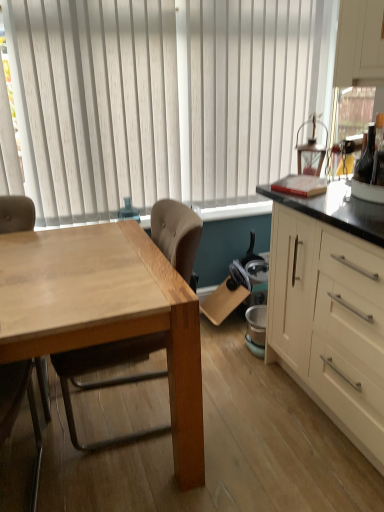
This screenshot has height=512, width=384. I want to click on light brown wood chair at left, acting as the first chair starting from the right, so click(x=107, y=380).

Image resolution: width=384 pixels, height=512 pixels. Describe the element at coordinates (107, 380) in the screenshot. I see `light brown wood chair at left, acting as the 2th chair starting from the left` at that location.

In order to face white vertical blinds at upper center, should I rotate leftwards or rightwards?

You should look left and rotate roughly 1.373 degrees.

This screenshot has height=512, width=384. In order to click on white vertical blinds at upper center in this screenshot , I will do `click(164, 100)`.

Measure the distance between white matte cabinet at right and camera.

A distance of 1.30 meters exists between white matte cabinet at right and camera.

Identify the location of light brown wood chair at left, acting as the 2th chair starting from the left. The image size is (384, 512). (107, 380).

Does white vertical blinds at upper center have a smaller size compared to white matte cabinet at right?

Correct, white vertical blinds at upper center occupies less space than white matte cabinet at right.

At what (x,y) coordinates should I click in order to perform the action: click on cabinetry located on the right of white vertical blinds at upper center. Please return your answer as a coordinate pair (x, y). Looking at the image, I should click on (330, 308).

From the image's perspective, is white vertical blinds at upper center above or below white matte cabinet at right?

From the image's perspective, white vertical blinds at upper center appears above white matte cabinet at right.

In terms of width, does white vertical blinds at upper center look wider or thinner when compared to white matte cabinet at right?

In the image, white vertical blinds at upper center appears to be more narrow than white matte cabinet at right.

Considering the sizes of objects white vertical blinds at upper center and light brown wood chair at left, which is the 1th chair in left-to-right order, in the image provided, who is smaller, white vertical blinds at upper center or light brown wood chair at left, which is the 1th chair in left-to-right order,?

Smaller between the two is light brown wood chair at left, which is the 1th chair in left-to-right order.

Considering the sizes of white vertical blinds at upper center and light brown wood chair at left, marked as the 2th chair in a right-to-left arrangement, in the image, is white vertical blinds at upper center wider or thinner than light brown wood chair at left, marked as the 2th chair in a right-to-left arrangement,?

white vertical blinds at upper center is thinner than light brown wood chair at left, marked as the 2th chair in a right-to-left arrangement.

From a real-world perspective, which is physically above, white vertical blinds at upper center or light brown wood chair at left, which is the 1th chair in left-to-right order?

white vertical blinds at upper center, from a real-world perspective.

Where is `the 2nd chair located beneath the white vertical blinds at upper center (from a real-world perspective)`? This screenshot has height=512, width=384. the 2nd chair located beneath the white vertical blinds at upper center (from a real-world perspective) is located at coordinates (16, 214).

From a real-world perspective, which is physically above, light brown wood chair at left, marked as the 2th chair in a right-to-left arrangement, or white vertical blinds at upper center?

white vertical blinds at upper center, from a real-world perspective.

From the image's perspective, which one is positioned lower, light brown wood chair at left, which is the 1th chair in left-to-right order, or white vertical blinds at upper center?

From the image's view, light brown wood chair at left, which is the 1th chair in left-to-right order, is below.

Which object is closer to the camera, light brown wood chair at left, which is the 1th chair in left-to-right order, or white vertical blinds at upper center?

light brown wood chair at left, which is the 1th chair in left-to-right order, is closer to the camera.

Where is `window blind on the right of light brown wood chair at left, acting as the 2th chair starting from the left`? Image resolution: width=384 pixels, height=512 pixels. window blind on the right of light brown wood chair at left, acting as the 2th chair starting from the left is located at coordinates (164, 100).

Can you confirm if light brown wood chair at left, acting as the first chair starting from the right, is positioned to the right of white vertical blinds at upper center?

Incorrect, light brown wood chair at left, acting as the first chair starting from the right, is not on the right side of white vertical blinds at upper center.

Could you tell me if light brown wood chair at left, acting as the 2th chair starting from the left, is facing white vertical blinds at upper center?

No, light brown wood chair at left, acting as the 2th chair starting from the left, is not turned towards white vertical blinds at upper center.

Is light brown wood chair at left, acting as the first chair starting from the right, in front of or behind white vertical blinds at upper center in the image?

light brown wood chair at left, acting as the first chair starting from the right, is positioned closer to the viewer than white vertical blinds at upper center.

Is white vertical blinds at upper center touching light brown wood chair at left, acting as the first chair starting from the right?

No, white vertical blinds at upper center is not touching light brown wood chair at left, acting as the first chair starting from the right.

Can you confirm if white vertical blinds at upper center is smaller than light brown wood chair at left, acting as the 2th chair starting from the left?

Correct, white vertical blinds at upper center occupies less space than light brown wood chair at left, acting as the 2th chair starting from the left.

Is white vertical blinds at upper center at the right side of light brown wood chair at left, acting as the 2th chair starting from the left?

Correct, you'll find white vertical blinds at upper center to the right of light brown wood chair at left, acting as the 2th chair starting from the left.

Considering the positions of point (314, 11) and point (105, 352), is point (314, 11) closer or farther from the camera than point (105, 352)?

Point (314, 11) is farther from the camera than point (105, 352).

Which is in front, light brown wood chair at left, acting as the first chair starting from the right, or white matte cabinet at right?

Positioned in front is white matte cabinet at right.

Which is more to the left, light brown wood chair at left, acting as the first chair starting from the right, or white matte cabinet at right?

light brown wood chair at left, acting as the first chair starting from the right, is more to the left.

Is light brown wood chair at left, acting as the first chair starting from the right, completely or partially outside of white matte cabinet at right?

Absolutely, light brown wood chair at left, acting as the first chair starting from the right, is external to white matte cabinet at right.

From the image's perspective, which is above, light brown wood chair at left, acting as the 2th chair starting from the left, or white matte cabinet at right?

white matte cabinet at right.

Is light brown wood chair at left, acting as the 2th chair starting from the left, touching light brown wood chair at left, marked as the 2th chair in a right-to-left arrangement?

No, light brown wood chair at left, acting as the 2th chair starting from the left, is not beside light brown wood chair at left, marked as the 2th chair in a right-to-left arrangement.

Is light brown wood chair at left, acting as the first chair starting from the right, facing towards light brown wood chair at left, marked as the 2th chair in a right-to-left arrangement?

Yes, light brown wood chair at left, acting as the first chair starting from the right, is aimed at light brown wood chair at left, marked as the 2th chair in a right-to-left arrangement.

At what (x,y) coordinates should I click in order to perform the action: click on chair behind the light brown wood chair at left, acting as the first chair starting from the right. Please return your answer as a coordinate pair (x, y). This screenshot has width=384, height=512. Looking at the image, I should click on (16, 214).

Which object is positioned more to the left, light brown wood chair at left, acting as the 2th chair starting from the left, or light brown wood chair at left, marked as the 2th chair in a right-to-left arrangement?

From the viewer's perspective, light brown wood chair at left, marked as the 2th chair in a right-to-left arrangement, appears more on the left side.

Locate an element on the screen. The height and width of the screenshot is (512, 384). cabinetry on the right of white vertical blinds at upper center is located at coordinates (330, 308).

Image resolution: width=384 pixels, height=512 pixels. Find the location of `window blind behind the light brown wood chair at left, marked as the 2th chair in a right-to-left arrangement`. window blind behind the light brown wood chair at left, marked as the 2th chair in a right-to-left arrangement is located at coordinates (164, 100).

Which object lies further to the anchor point white vertical blinds at upper center, light brown wood chair at left, acting as the 2th chair starting from the left, or light brown wood chair at left, marked as the 2th chair in a right-to-left arrangement?

light brown wood chair at left, marked as the 2th chair in a right-to-left arrangement, lies further to white vertical blinds at upper center than the other object.

When comparing their distances from white vertical blinds at upper center, does light brown wood chair at left, marked as the 2th chair in a right-to-left arrangement, or white matte cabinet at right seem closer?

light brown wood chair at left, marked as the 2th chair in a right-to-left arrangement.

Estimate the real-world distances between objects in this image. Which object is closer to white vertical blinds at upper center, light brown wood chair at left, which is the 1th chair in left-to-right order, or light brown wood chair at left, acting as the 2th chair starting from the left?

light brown wood chair at left, acting as the 2th chair starting from the left, is positioned closer to the anchor white vertical blinds at upper center.

When comparing their distances from light brown wood chair at left, acting as the 2th chair starting from the left, does white matte cabinet at right or light brown wood chair at left, marked as the 2th chair in a right-to-left arrangement, seem further?

The object further to light brown wood chair at left, acting as the 2th chair starting from the left, is light brown wood chair at left, marked as the 2th chair in a right-to-left arrangement.

Which object lies nearer to the anchor point light brown wood chair at left, acting as the 2th chair starting from the left, white vertical blinds at upper center or white matte cabinet at right?

white matte cabinet at right is closer to light brown wood chair at left, acting as the 2th chair starting from the left.

Based on the photo, estimate the real-world distances between objects in this image. Which object is closer to light brown wood chair at left, which is the 1th chair in left-to-right order, light brown wood chair at left, acting as the first chair starting from the right, or white vertical blinds at upper center?

light brown wood chair at left, acting as the first chair starting from the right.

Based on their spatial positions, is white matte cabinet at right or light brown wood chair at left, acting as the 2th chair starting from the left, further from white vertical blinds at upper center?

white matte cabinet at right is further to white vertical blinds at upper center.

Estimate the real-world distances between objects in this image. Which object is further from light brown wood chair at left, which is the 1th chair in left-to-right order, light brown wood chair at left, acting as the first chair starting from the right, or white matte cabinet at right?

white matte cabinet at right is positioned further to the anchor light brown wood chair at left, which is the 1th chair in left-to-right order.

Image resolution: width=384 pixels, height=512 pixels. I want to click on cabinetry that lies between white vertical blinds at upper center and light brown wood chair at left, acting as the 2th chair starting from the left, from top to bottom, so click(330, 308).

Find the location of `chair between white vertical blinds at upper center and light brown wood chair at left, acting as the 2th chair starting from the left, in the vertical direction`. chair between white vertical blinds at upper center and light brown wood chair at left, acting as the 2th chair starting from the left, in the vertical direction is located at coordinates [x=16, y=214].

Find the location of a particular element. Image resolution: width=384 pixels, height=512 pixels. chair situated between light brown wood chair at left, marked as the 2th chair in a right-to-left arrangement, and white matte cabinet at right from left to right is located at coordinates (107, 380).

You are a GUI agent. You are given a task and a screenshot of the screen. Output one action in this format:
    pyautogui.click(x=<x>, y=<y>)
    Task: Click on the window blind located between light brown wood chair at left, which is the 1th chair in left-to-right order, and white matte cabinet at right in the left-right direction
    The height and width of the screenshot is (512, 384).
    Given the screenshot: What is the action you would take?
    pyautogui.click(x=164, y=100)